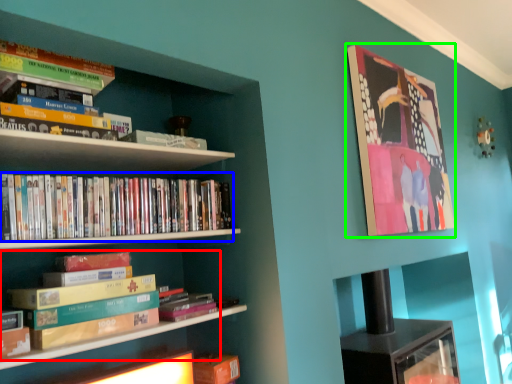
Question: Based on their relative distances, which object is farther from book (highlighted by a red box)? Choose from book (highlighted by a blue box) and picture frame (highlighted by a green box).

Choices:
 (A) book
 (B) picture frame

Answer: (B)